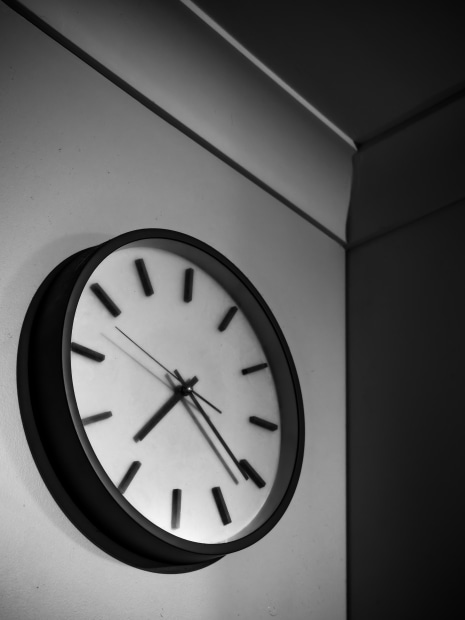
The width and height of the screenshot is (465, 620). What are the coordinates of `ceiling` in the screenshot? It's located at (368, 58).